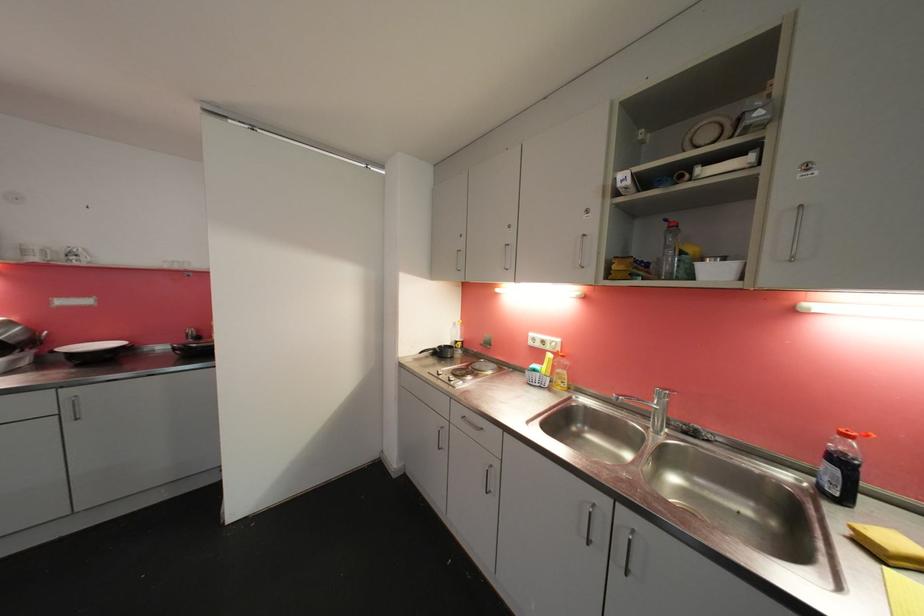
Where would you lift the metal faucet lever? Please return your answer as a coordinate pair (x, y).

(667, 390)